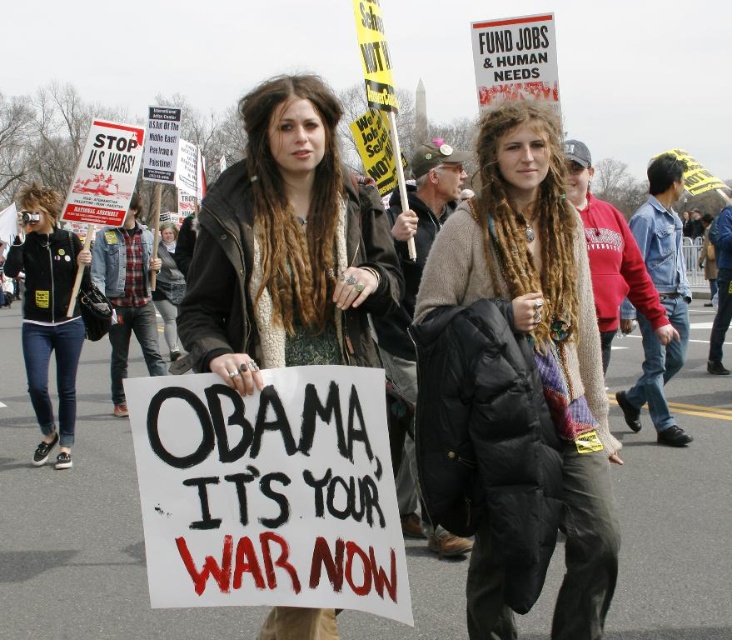
You are a photographer trying to capture a clear shot of both the matte black jacket at center and the black leather jacket at left. Based on their sizes in the image, which jacket should you focus on first to ensure it fits within your camera frame?

The matte black jacket at center might be wider than black leather jacket at left, so focusing on the matte black jacket at center first would ensure it fits within the frame before adjusting for the narrower black leather jacket at left.

You are a photographer trying to capture a photo of the knitted sweater at center and the black leather jacket at left. Based on their heights, which one should you focus on first to ensure both are in frame?

The knitted sweater at center is taller than the black leather jacket at left, so you should focus on the knitted sweater at center first to ensure both are in frame.